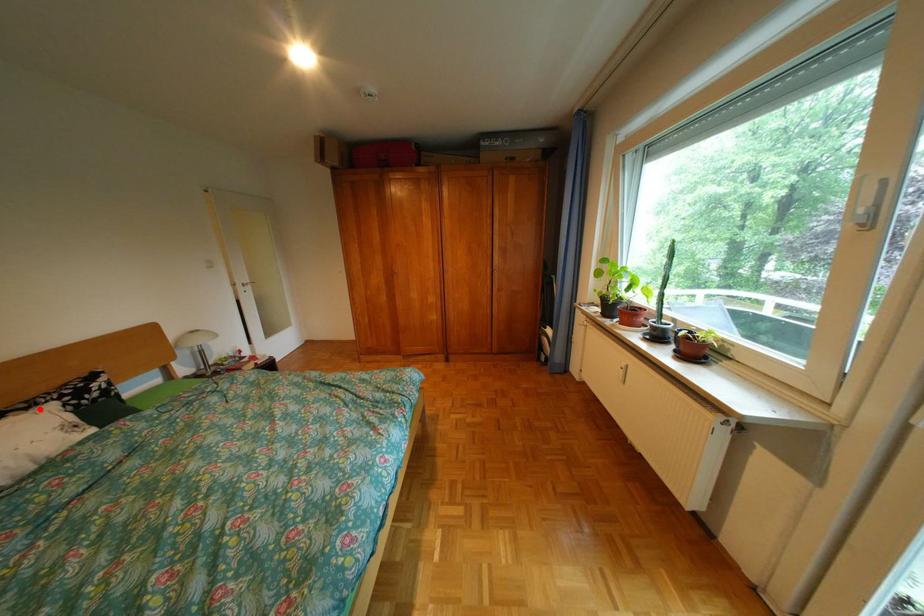
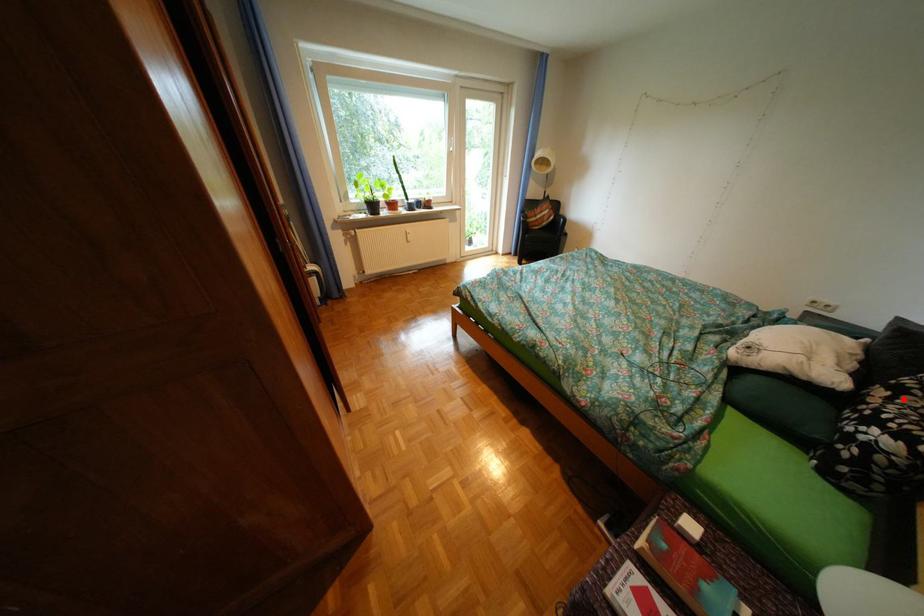
I am providing you with two images of the same scene from different viewpoints. A red point is marked on the first image and another point is marked on the second image. Does the point marked in image1 correspond to the same location as the one in image2?

Yes